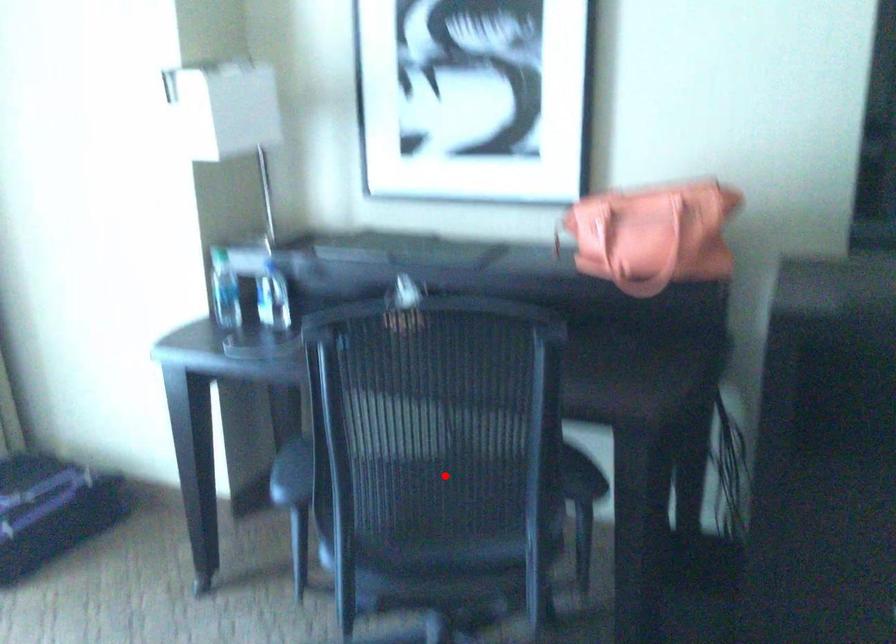
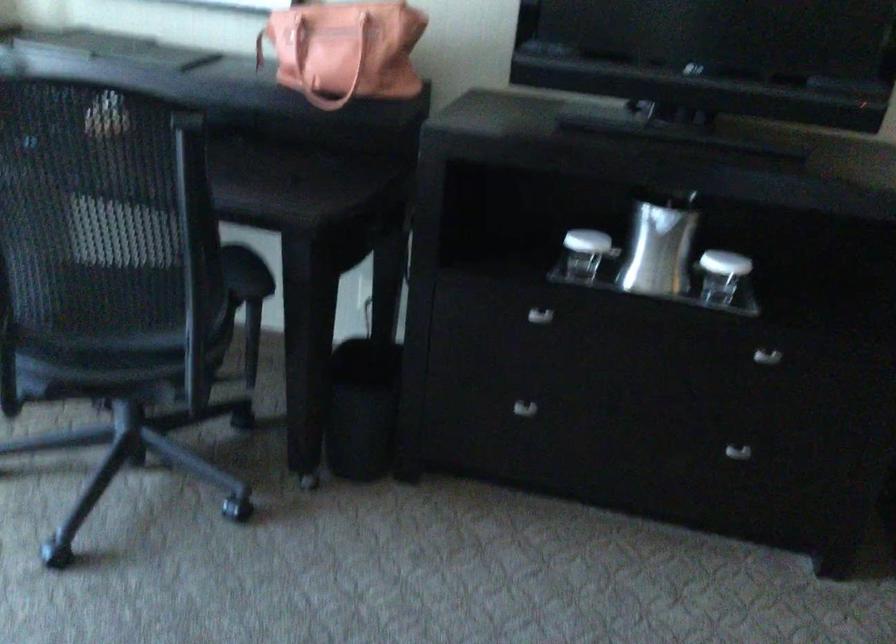
The point at the highlighted location is marked in the first image. Where is the corresponding point in the second image?

(107, 265)